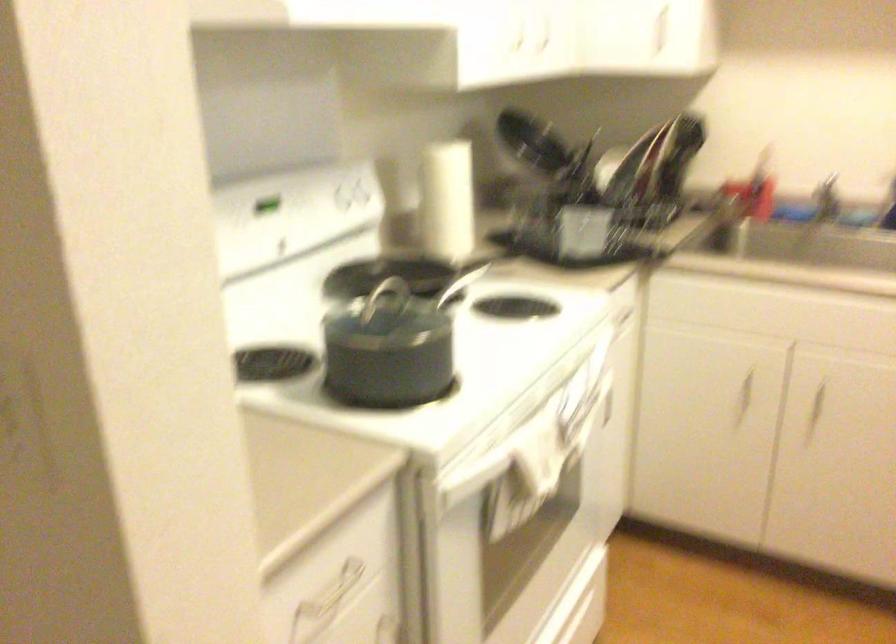
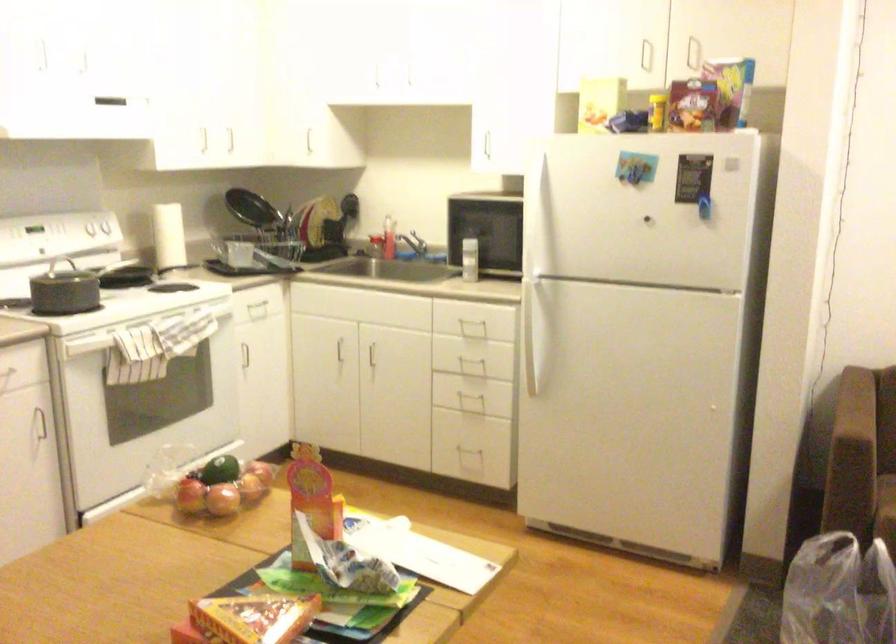
In the second image, find the point that corresponds to [748,192] in the first image.

(403, 247)